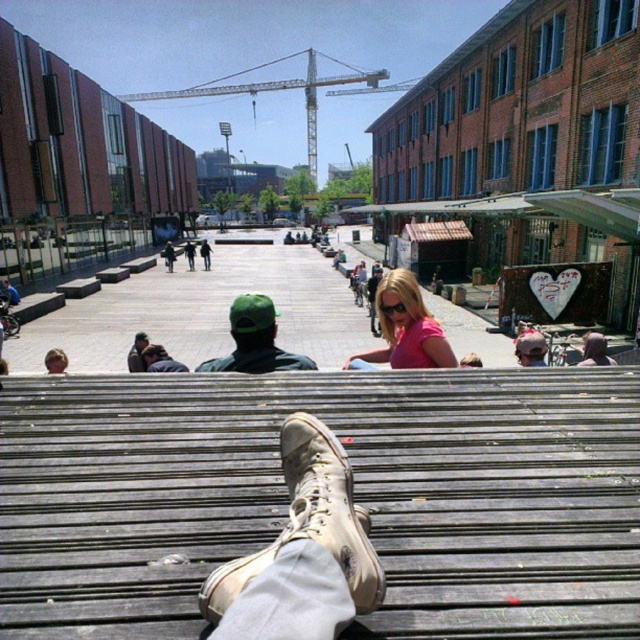
You are sitting on the wooden bench at center and notice a tan suede boot at center near your feet. Is the boot placed under the bench or on top of it?

The wooden bench at center is located above the tan suede boot at center, meaning the boot is placed under the bench.

You are sitting on a bench in the public square and want to know if the green cap at center is taller than the matte black jacket at lower left. Can you determine this based on their positions?

The green cap at center is taller than matte black jacket at lower left according to their positions in the scene.

You are sitting on the wooden bench at center and notice a tan suede boot at center. Where is the boot located relative to the bench?

The tan suede boot at center is behind the wooden bench at center, so it is positioned behind the bench where you are sitting.